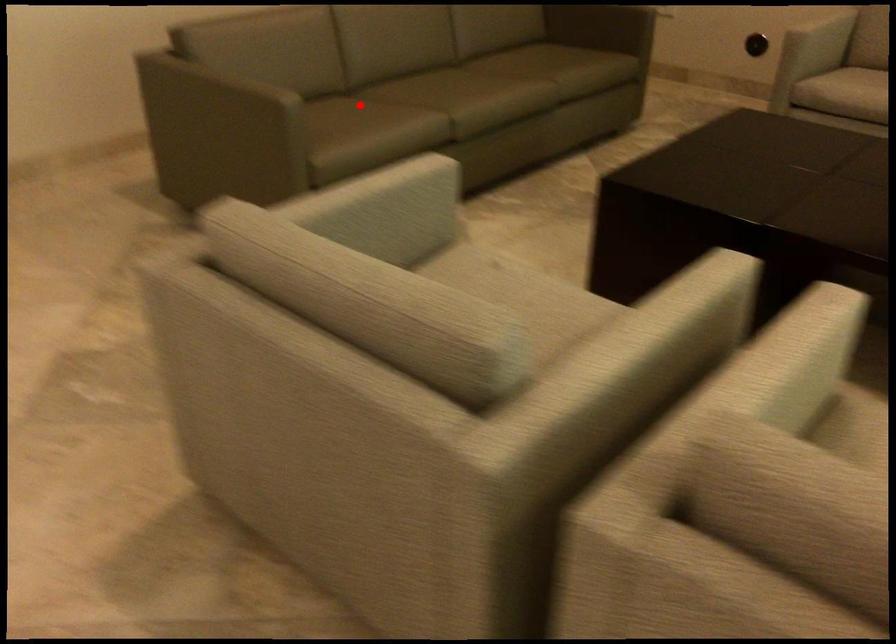
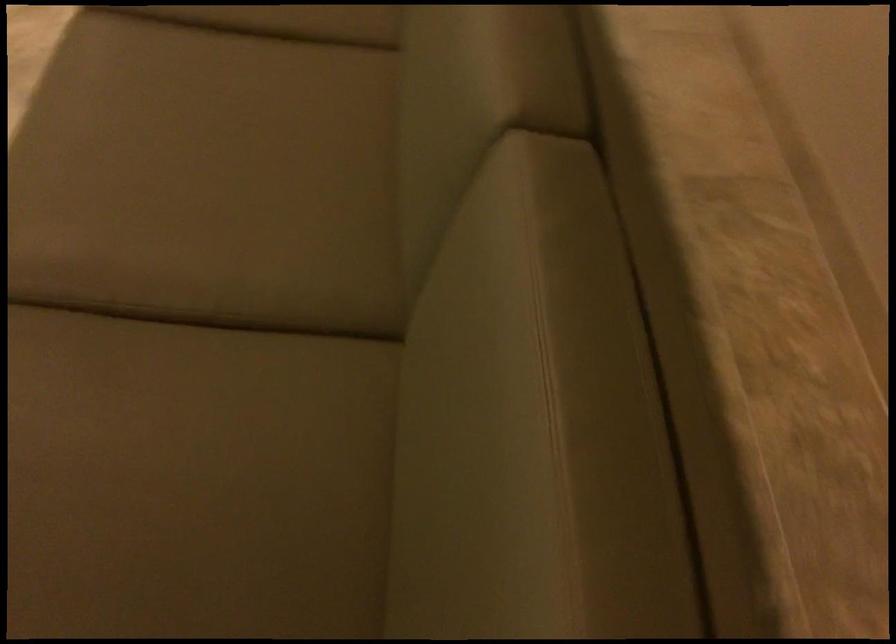
Question: A red point is marked in image1. In image2, is the corresponding 3D point closer to the camera or farther? Reply with the corresponding letter.

Choices:
 (A) The corresponding 3D point is closer.
 (B) The corresponding 3D point is farther.

Answer: (A)